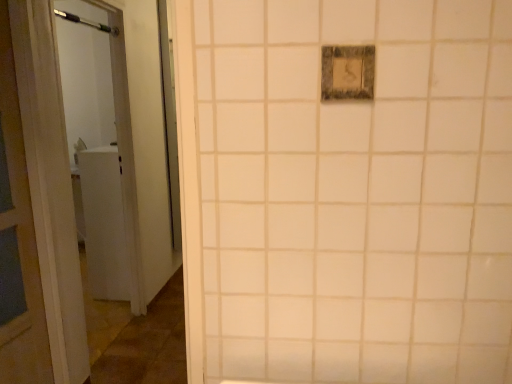
What do you see at coordinates (347, 72) in the screenshot? I see `matte gray switch at upper center` at bounding box center [347, 72].

In order to click on matte gray switch at upper center in this screenshot , I will do `click(347, 72)`.

Measure the distance between point (335, 76) and camera.

Point (335, 76) and camera are 31.89 inches apart from each other.

Find the location of a particular element. The image size is (512, 384). brushed metal shower at upper left is located at coordinates (86, 22).

This screenshot has height=384, width=512. What do you see at coordinates (86, 22) in the screenshot?
I see `brushed metal shower at upper left` at bounding box center [86, 22].

Image resolution: width=512 pixels, height=384 pixels. I want to click on matte gray switch at upper center, so click(x=347, y=72).

Would you say brushed metal shower at upper left is to the left or to the right of matte gray switch at upper center in the picture?

Based on their positions, brushed metal shower at upper left is located to the left of matte gray switch at upper center.

Considering the positions of objects brushed metal shower at upper left and matte gray switch at upper center in the image provided, who is behind, brushed metal shower at upper left or matte gray switch at upper center?

brushed metal shower at upper left.

Between point (118, 31) and point (343, 61), which one is positioned in front?

The point (343, 61) is more forward.

From the image's perspective, relative to matte gray switch at upper center, is brushed metal shower at upper left above or below?

Based on their image positions, brushed metal shower at upper left is located above matte gray switch at upper center.

From a real-world perspective, is brushed metal shower at upper left physically below matte gray switch at upper center?

No.

Can you confirm if brushed metal shower at upper left is wider than matte gray switch at upper center?

Correct, the width of brushed metal shower at upper left exceeds that of matte gray switch at upper center.

Can you confirm if brushed metal shower at upper left is shorter than matte gray switch at upper center?

Correct, brushed metal shower at upper left is not as tall as matte gray switch at upper center.

Considering the sizes of objects brushed metal shower at upper left and matte gray switch at upper center in the image provided, who is bigger, brushed metal shower at upper left or matte gray switch at upper center?

Bigger between the two is brushed metal shower at upper left.

Would you say brushed metal shower at upper left is outside matte gray switch at upper center?

brushed metal shower at upper left is positioned outside matte gray switch at upper center.

Is brushed metal shower at upper left directly adjacent to matte gray switch at upper center?

No, brushed metal shower at upper left is not touching matte gray switch at upper center.

Does brushed metal shower at upper left turn towards matte gray switch at upper center?

No, brushed metal shower at upper left is not aimed at matte gray switch at upper center.

Can you tell me how much brushed metal shower at upper left and matte gray switch at upper center differ in facing direction?

The angular difference between brushed metal shower at upper left and matte gray switch at upper center is 88.9 degrees.

How far apart are brushed metal shower at upper left and matte gray switch at upper center?

A distance of 2.92 meters exists between brushed metal shower at upper left and matte gray switch at upper center.

This screenshot has height=384, width=512. I want to click on shower that appears on the left of matte gray switch at upper center, so click(x=86, y=22).

Between matte gray switch at upper center and brushed metal shower at upper left, which one appears on the right side from the viewer's perspective?

From the viewer's perspective, matte gray switch at upper center appears more on the right side.

Is matte gray switch at upper center in front of brushed metal shower at upper left?

That is True.

Between point (349, 48) and point (86, 21), which one is positioned behind?

The point (86, 21) is farther from the camera.

From the image's perspective, which one is positioned lower, matte gray switch at upper center or brushed metal shower at upper left?

matte gray switch at upper center, from the image's perspective.

From a real-world perspective, is matte gray switch at upper center positioned over brushed metal shower at upper left based on gravity?

No.

Consider the image. Looking at their sizes, would you say matte gray switch at upper center is wider or thinner than brushed metal shower at upper left?

In the image, matte gray switch at upper center appears to be more narrow than brushed metal shower at upper left.

Which of these two, matte gray switch at upper center or brushed metal shower at upper left, stands taller?

matte gray switch at upper center is taller.

Considering the sizes of objects matte gray switch at upper center and brushed metal shower at upper left in the image provided, who is bigger, matte gray switch at upper center or brushed metal shower at upper left?

brushed metal shower at upper left.

Choose the correct answer: Is matte gray switch at upper center inside brushed metal shower at upper left or outside it?

matte gray switch at upper center lies outside brushed metal shower at upper left.

Can you see matte gray switch at upper center touching brushed metal shower at upper left?

No.

Could you tell me if matte gray switch at upper center is facing brushed metal shower at upper left?

No, matte gray switch at upper center is not aimed at brushed metal shower at upper left.

Consider the image. Measure the distance from matte gray switch at upper center to brushed metal shower at upper left.

9.59 feet.

Find the location of a particular element. This screenshot has height=384, width=512. shower on the left of matte gray switch at upper center is located at coordinates (86, 22).

The image size is (512, 384). What are the coordinates of `light switch directly beneath the brushed metal shower at upper left (from a real-world perspective)` in the screenshot? It's located at (347, 72).

Identify the location of shower lying on the left of matte gray switch at upper center. (86, 22).